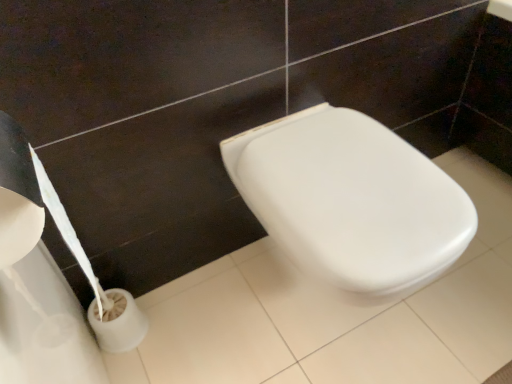
In order to click on white glossy toilet at center in this screenshot , I will do (x=351, y=200).

The image size is (512, 384). Describe the element at coordinates (351, 200) in the screenshot. I see `white glossy toilet at center` at that location.

Where is `white glossy toilet at center`? Image resolution: width=512 pixels, height=384 pixels. white glossy toilet at center is located at coordinates (351, 200).